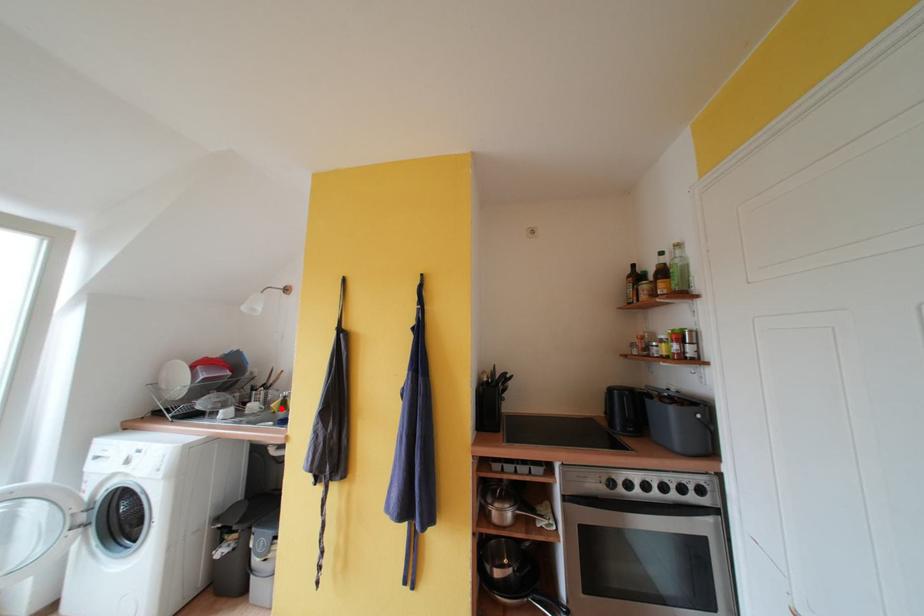
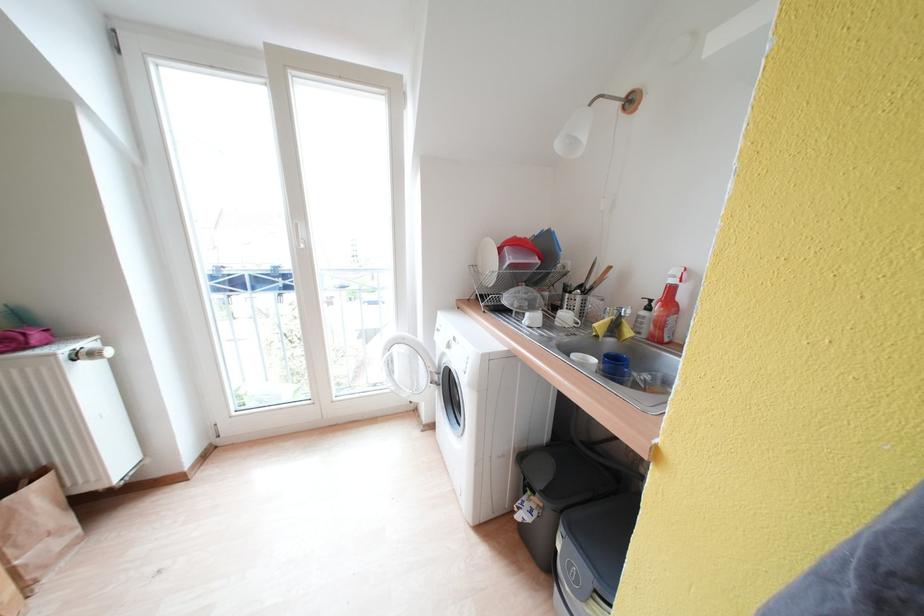
Find the pixel in the second image that matches the highlighted location in the first image.

(606, 330)